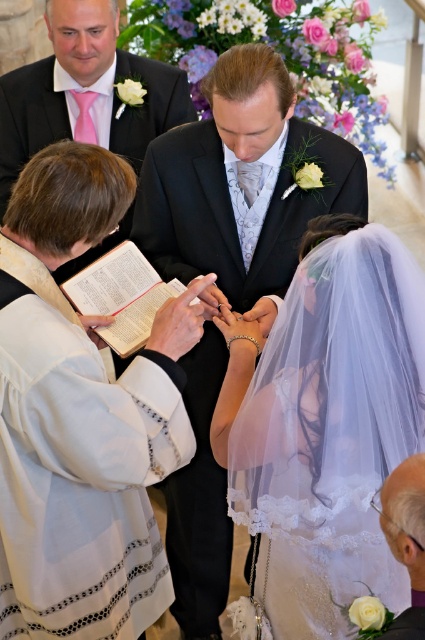
Question: Can you confirm if black satin suit at center is positioned below hardcover book at center?

Choices:
 (A) no
 (B) yes

Answer: (B)

Question: Which object appears farthest from the camera in this image?

Choices:
 (A) white lace veil at center
 (B) matte pink tie at upper left

Answer: (B)

Question: Which object is farther from the camera taking this photo?

Choices:
 (A) hardcover book at center
 (B) matte pink tie at upper left

Answer: (B)

Question: Where is white lace veil at center located in relation to black satin suit at center in the image?

Choices:
 (A) left
 (B) right

Answer: (B)

Question: Which object is farther from the camera taking this photo?

Choices:
 (A) white lace veil at center
 (B) matte pink tie at upper left
 (C) black satin suit at center

Answer: (B)

Question: Does white lace veil at center have a lesser width compared to hardcover book at center?

Choices:
 (A) no
 (B) yes

Answer: (A)